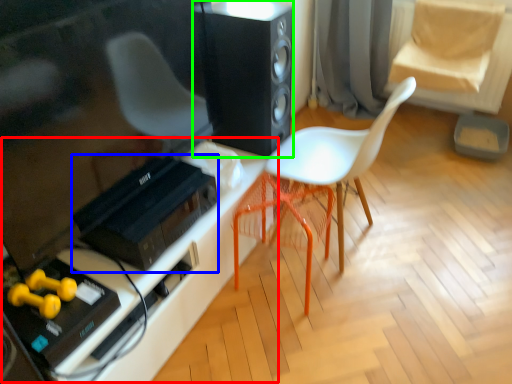
Question: Based on their relative distances, which object is nearer to table (highlighted by a red box)? Choose from stereo (highlighted by a blue box) and loudspeaker (highlighted by a green box).

Choices:
 (A) stereo
 (B) loudspeaker

Answer: (A)